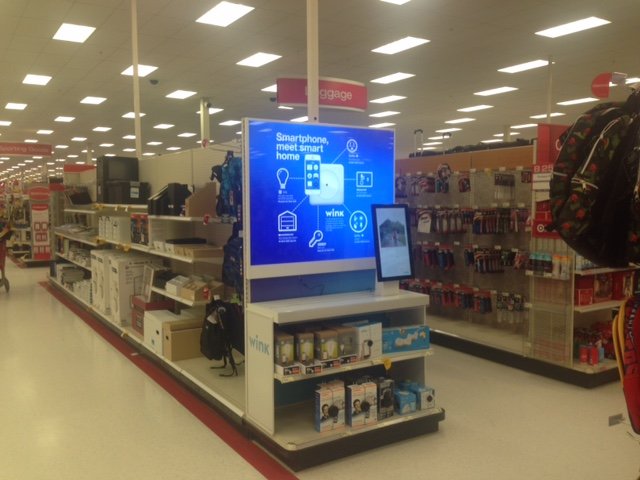
The height and width of the screenshot is (480, 640). In order to click on ceiling in this screenshot , I will do `click(336, 32)`.